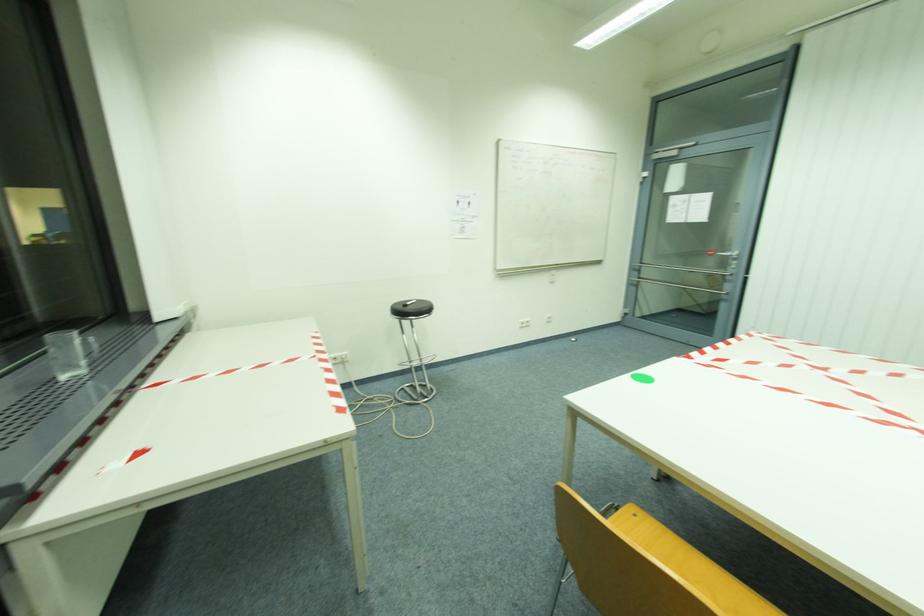
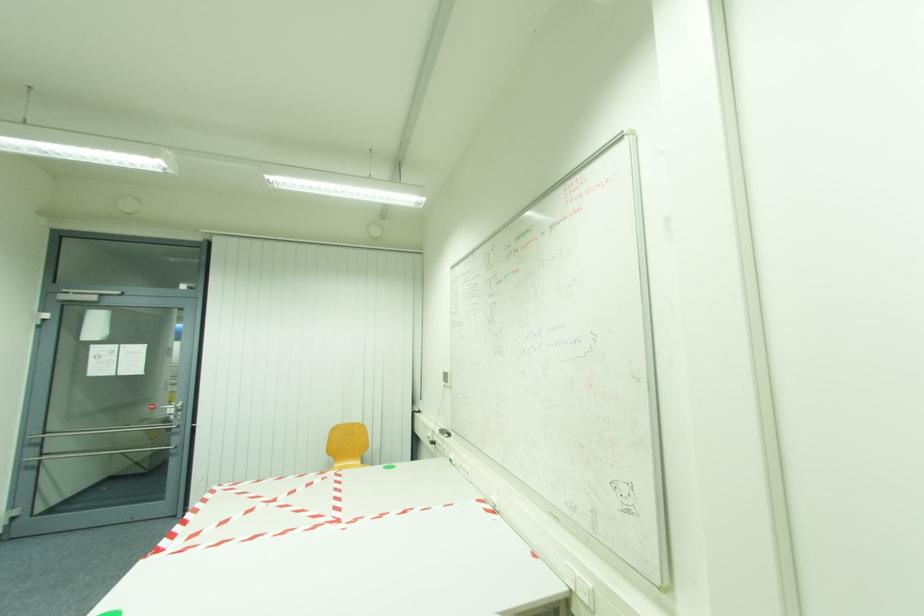
Question: The camera is either moving clockwise (left) or counter-clockwise (right) around the object. The first image is from the beginning of the video and the second image is from the end. Is the camera moving left or right when shooting the video?

Choices:
 (A) Left
 (B) Right

Answer: (A)